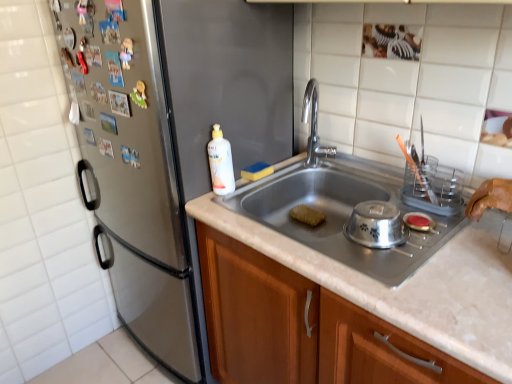
Question: From the image's perspective, is silver metallic bowl at sink below satin silver refrigerator at left?

Choices:
 (A) no
 (B) yes

Answer: (B)

Question: Can you confirm if silver metallic bowl at sink is bigger than satin silver refrigerator at left?

Choices:
 (A) no
 (B) yes

Answer: (A)

Question: Does silver metallic bowl at sink appear on the right side of satin silver refrigerator at left?

Choices:
 (A) yes
 (B) no

Answer: (A)

Question: Are silver metallic bowl at sink and satin silver refrigerator at left far apart?

Choices:
 (A) yes
 (B) no

Answer: (B)

Question: From a real-world perspective, is silver metallic bowl at sink below satin silver refrigerator at left?

Choices:
 (A) yes
 (B) no

Answer: (B)

Question: Can you confirm if silver metallic bowl at sink is taller than satin silver refrigerator at left?

Choices:
 (A) yes
 (B) no

Answer: (B)

Question: Is wooden cabinet at center facing towards white glossy bottle at center?

Choices:
 (A) no
 (B) yes

Answer: (A)

Question: Is wooden cabinet at center closer to camera compared to white glossy bottle at center?

Choices:
 (A) yes
 (B) no

Answer: (A)

Question: Is wooden cabinet at center outside white glossy bottle at center?

Choices:
 (A) no
 (B) yes

Answer: (B)

Question: Does wooden cabinet at center appear on the right side of white glossy bottle at center?

Choices:
 (A) yes
 (B) no

Answer: (A)

Question: Can you confirm if wooden cabinet at center is wider than white glossy bottle at center?

Choices:
 (A) no
 (B) yes

Answer: (B)

Question: Considering the relative sizes of wooden cabinet at center and white glossy bottle at center in the image provided, is wooden cabinet at center taller than white glossy bottle at center?

Choices:
 (A) yes
 (B) no

Answer: (A)

Question: Would you say silver metallic bowl at sink is a long distance from polished stainless steel faucet at center?

Choices:
 (A) yes
 (B) no

Answer: (B)